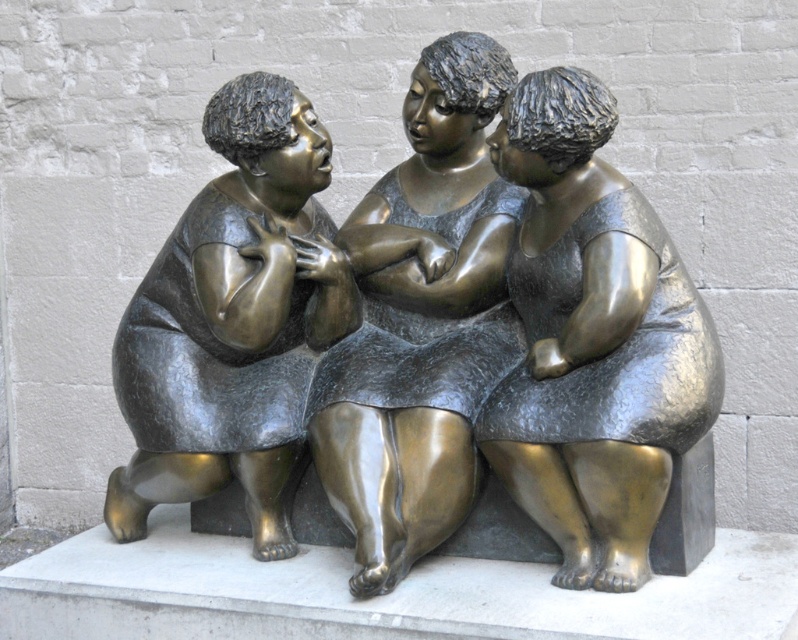
Is bronze sculpture at center below bronze statue at center?

Yes, bronze sculpture at center is below bronze statue at center.

Where is `bronze sculpture at center`? bronze sculpture at center is located at coordinates (514, 340).

Is point (650, 384) closer to viewer compared to point (285, 458)?

Yes, it is.

Locate an element on the screen. bronze sculpture at center is located at coordinates (514, 340).

Can you confirm if bronze textured dress at center is wider than bronze statue at center?

In fact, bronze textured dress at center might be narrower than bronze statue at center.

Is point (372, 580) farther from viewer compared to point (275, 356)?

That is False.

Where is `bronze textured dress at center`? The height and width of the screenshot is (640, 798). bronze textured dress at center is located at coordinates (421, 321).

Can you confirm if bronze sculpture at center is wider than bronze textured dress at center?

Indeed, bronze sculpture at center has a greater width compared to bronze textured dress at center.

Which is more to the left, bronze sculpture at center or bronze textured dress at center?

bronze sculpture at center

Is point (506, 113) positioned in front of point (378, 429)?

Yes.

Find the location of a particular element. The image size is (798, 640). bronze sculpture at center is located at coordinates (514, 340).